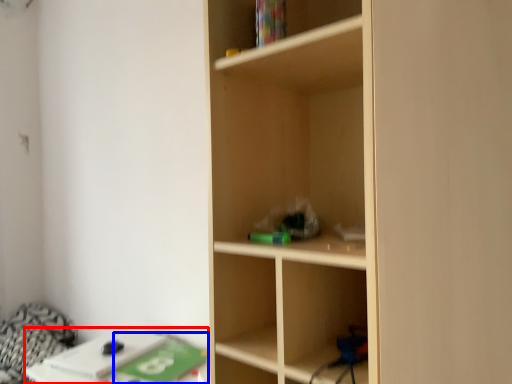
Question: Which of the following is the farthest to the observer, table (highlighted by a red box) or paperback book (highlighted by a blue box)?

Choices:
 (A) table
 (B) paperback book

Answer: (A)